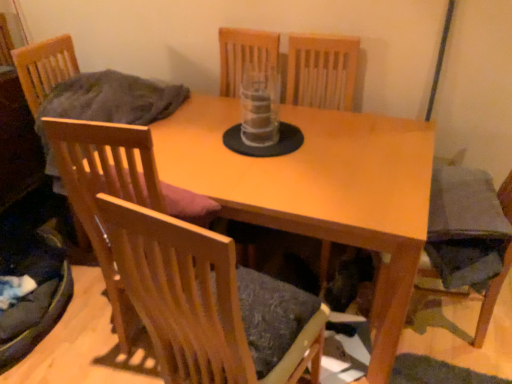
Question: From the image's perspective, would you say wooden chair at left, which ranks as the 1th chair in left-to-right order, is shown under wooden chair at center, which is the 1th chair in right-to-left order?

Choices:
 (A) no
 (B) yes

Answer: (A)

Question: Can we say wooden chair at left, which ranks as the 1th chair in left-to-right order, lies outside wooden chair at center, which is the 1th chair in right-to-left order?

Choices:
 (A) yes
 (B) no

Answer: (A)

Question: Is wooden chair at left, the 3th chair when ordered from right to left, facing towards wooden chair at center, acting as the third chair starting from the left?

Choices:
 (A) yes
 (B) no

Answer: (B)

Question: Does wooden chair at left, the 3th chair when ordered from right to left, have a larger size compared to wooden chair at center, acting as the third chair starting from the left?

Choices:
 (A) no
 (B) yes

Answer: (A)

Question: Is wooden chair at left, the 3th chair when ordered from right to left, beside wooden chair at center, which is the 1th chair in right-to-left order?

Choices:
 (A) yes
 (B) no

Answer: (B)

Question: Is wooden chair at center, which is the 1th chair in right-to-left order, inside wooden chair at left, which ranks as the 1th chair in left-to-right order?

Choices:
 (A) yes
 (B) no

Answer: (B)

Question: Is light wood table at center positioned in front of wooden chair at center, acting as the third chair starting from the left?

Choices:
 (A) yes
 (B) no

Answer: (B)

Question: Is light wood table at center completely or partially outside of wooden chair at center, which is the 1th chair in right-to-left order?

Choices:
 (A) yes
 (B) no

Answer: (A)

Question: Is light wood table at center smaller than wooden chair at center, acting as the third chair starting from the left?

Choices:
 (A) yes
 (B) no

Answer: (B)

Question: Is light wood table at center at the left side of wooden chair at center, acting as the third chair starting from the left?

Choices:
 (A) no
 (B) yes

Answer: (A)

Question: From the image's perspective, is light wood table at center below wooden chair at center, which is the 1th chair in right-to-left order?

Choices:
 (A) no
 (B) yes

Answer: (A)

Question: From the image's perspective, would you say light wood table at center is positioned over wooden chair at center, acting as the third chair starting from the left?

Choices:
 (A) yes
 (B) no

Answer: (A)

Question: Is wooden chair at center, acting as the 2th chair starting from the left, to the right of velvet dark grey armchair at lower right from the viewer's perspective?

Choices:
 (A) no
 (B) yes

Answer: (A)